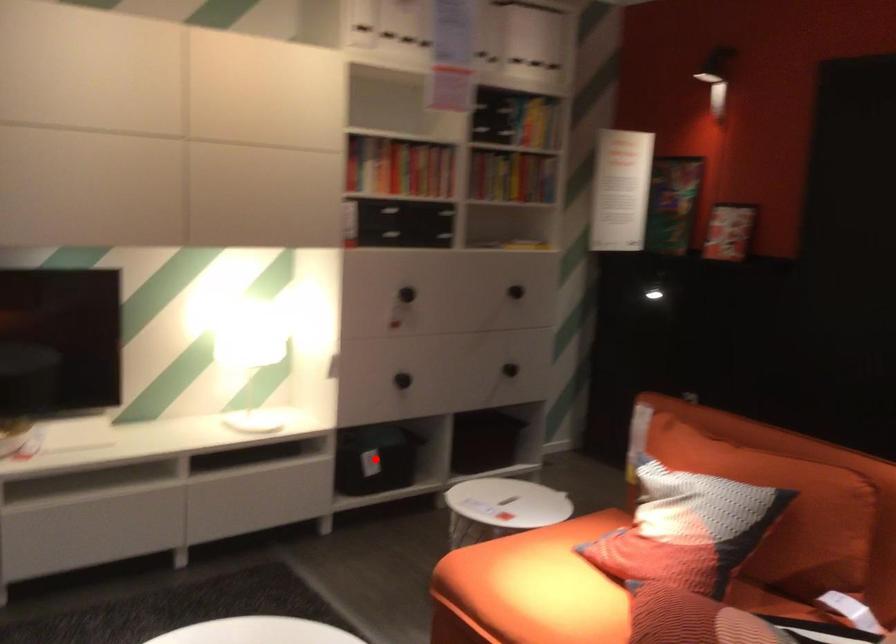
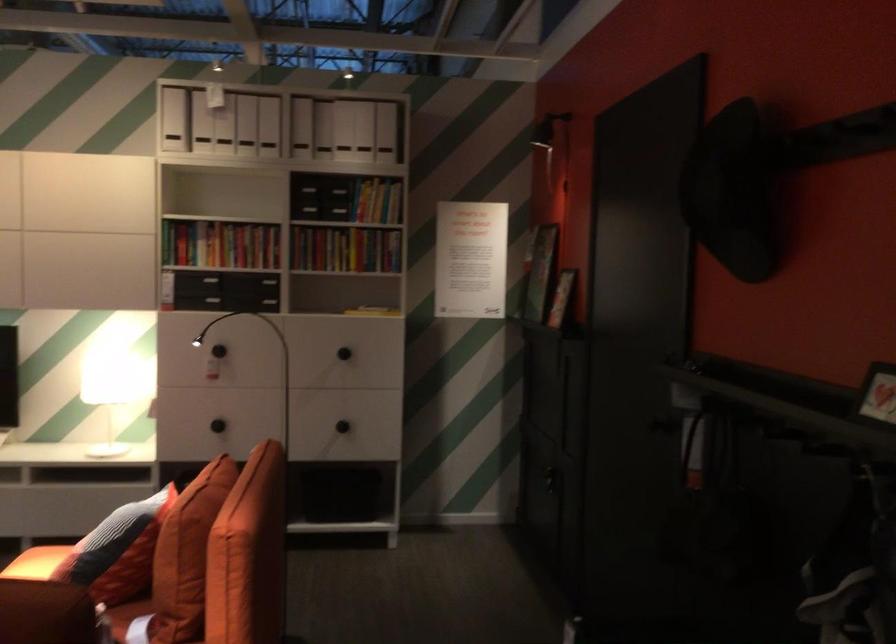
Question: I am providing you with two images of the same scene from different viewpoints. A red point is marked on the first image. Can you still see the location of the red point in image 2?

Choices:
 (A) Yes
 (B) No

Answer: (B)